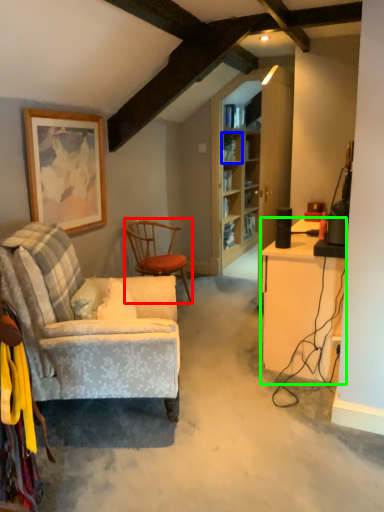
Question: Considering the real-world distances, which object is farthest from chair (highlighted by a red box)? shelf (highlighted by a blue box) or desk (highlighted by a green box)?

Choices:
 (A) shelf
 (B) desk

Answer: (A)